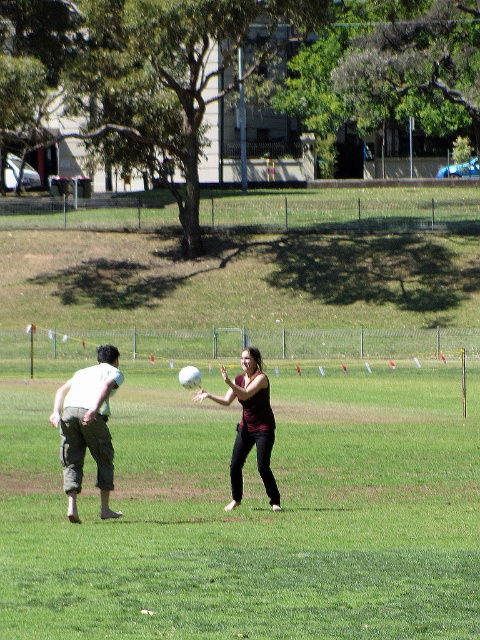
Which is in front, point (120, 470) or point (240, 448)?

Point (240, 448) is more forward.

The width and height of the screenshot is (480, 640). I want to click on white matte ball at center, so click(233, 433).

This screenshot has width=480, height=640. Find the location of `white matte ball at center`. white matte ball at center is located at coordinates (233, 433).

Consider the image. Who is more forward, (239, 493) or (259, 378)?

Positioned in front is point (259, 378).

Can you confirm if matte white frisbee at center is wider than matte black shirt at center?

Yes.

Is point (61, 429) closer to viewer compared to point (255, 448)?

Yes.

Locate an element on the screen. matte white frisbee at center is located at coordinates (251, 422).

Consider the image. Which is below, light green cotton shirt at left or matte black shirt at center?

Positioned lower is light green cotton shirt at left.

Can you confirm if light green cotton shirt at left is positioned above matte black shirt at center?

Incorrect, light green cotton shirt at left is not positioned above matte black shirt at center.

Where is `light green cotton shirt at left`? Image resolution: width=480 pixels, height=640 pixels. light green cotton shirt at left is located at coordinates (87, 426).

At what (x,y) coordinates should I click in order to perform the action: click on light green cotton shirt at left. Please return your answer as a coordinate pair (x, y). The width and height of the screenshot is (480, 640). Looking at the image, I should click on (87, 426).